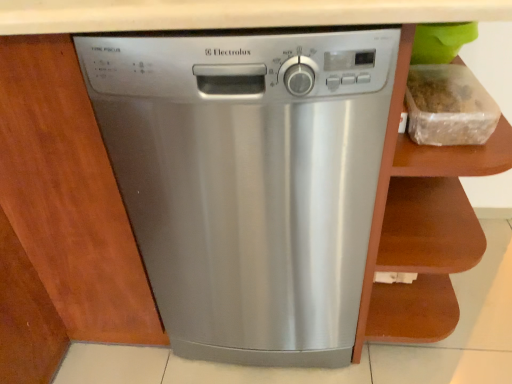
This screenshot has height=384, width=512. What do you see at coordinates (249, 180) in the screenshot?
I see `stainless steel dishwasher at center` at bounding box center [249, 180].

You are a GUI agent. You are given a task and a screenshot of the screen. Output one action in this format:
    pyautogui.click(x=<x>, y=<y>)
    Task: Click on the clear plastic container at upper right
    
    Given the screenshot: What is the action you would take?
    pyautogui.click(x=449, y=106)

Where is `brown wood cabinet at right`? This screenshot has height=384, width=512. brown wood cabinet at right is located at coordinates (422, 227).

Does stainless steel dishwasher at center turn towards brown wood cabinet at right?

No, stainless steel dishwasher at center is not turned towards brown wood cabinet at right.

From the picture: Is stainless steel dishwasher at center taller or shorter than brown wood cabinet at right?

In the image, stainless steel dishwasher at center appears to be taller than brown wood cabinet at right.

From the image's perspective, who appears lower, stainless steel dishwasher at center or brown wood cabinet at right?

From the image's view, stainless steel dishwasher at center is below.

Can you confirm if stainless steel dishwasher at center is smaller than brown wood cabinet at right?

No, stainless steel dishwasher at center is not smaller than brown wood cabinet at right.

Is brown wood cabinet at right not close to clear plastic container at upper right?

No, brown wood cabinet at right is not far from clear plastic container at upper right.

Which of these two, brown wood cabinet at right or clear plastic container at upper right, is bigger?

With larger size is brown wood cabinet at right.

Would you say brown wood cabinet at right contains clear plastic container at upper right?

Yes, clear plastic container at upper right is a part of brown wood cabinet at right.

Are clear plastic container at upper right and stainless steel dishwasher at center beside each other?

No, clear plastic container at upper right is not next to stainless steel dishwasher at center.

Based on their positions, is clear plastic container at upper right located to the left or right of stainless steel dishwasher at center?

Based on their positions, clear plastic container at upper right is located to the right of stainless steel dishwasher at center.

Between point (481, 134) and point (234, 305), which one is positioned behind?

The point (234, 305) is farther from the camera.

Based on the photo, who is shorter, clear plastic container at upper right or stainless steel dishwasher at center?

clear plastic container at upper right is shorter.

From the image's perspective, is stainless steel dishwasher at center located beneath clear plastic container at upper right?

Indeed, from the image's perspective, stainless steel dishwasher at center is shown beneath clear plastic container at upper right.

Is point (192, 136) positioned after point (484, 140)?

That is False.

From a real-world perspective, is stainless steel dishwasher at center on top of clear plastic container at upper right?

Actually, stainless steel dishwasher at center is physically below clear plastic container at upper right in the real world.

In terms of size, does clear plastic container at upper right appear bigger or smaller than brown wood cabinet at right?

clear plastic container at upper right is smaller than brown wood cabinet at right.

Is clear plastic container at upper right next to brown wood cabinet at right and touching it?

There is a gap between clear plastic container at upper right and brown wood cabinet at right.

From a real-world perspective, is clear plastic container at upper right above or below brown wood cabinet at right?

In terms of real-world spatial position, clear plastic container at upper right is above brown wood cabinet at right.

From a real-world perspective, which object stands above the other?

stainless steel dishwasher at center.

How different are the orientations of brown wood cabinet at right and stainless steel dishwasher at center in degrees?

They differ by 1.18 degrees in their facing directions.

Is point (452, 202) less distant than point (305, 264)?

That is False.

Can you confirm if brown wood cabinet at right is bigger than stainless steel dishwasher at center?

No.

This screenshot has width=512, height=384. What are the coordinates of `home appliance below the brown wood cabinet at right (from the image's perspective)` in the screenshot? It's located at (249, 180).

You are a GUI agent. You are given a task and a screenshot of the screen. Output one action in this format:
    pyautogui.click(x=<x>, y=<y>)
    Task: Click on the food above the brown wood cabinet at right (from a real-world perspective)
    
    Given the screenshot: What is the action you would take?
    pyautogui.click(x=449, y=106)

When comparing their distances from clear plastic container at upper right, does brown wood cabinet at right or stainless steel dishwasher at center seem closer?

brown wood cabinet at right is positioned closer to the anchor clear plastic container at upper right.

Considering their positions, is brown wood cabinet at right positioned further to stainless steel dishwasher at center than clear plastic container at upper right?

clear plastic container at upper right lies further to stainless steel dishwasher at center than the other object.

When comparing their distances from stainless steel dishwasher at center, does clear plastic container at upper right or brown wood cabinet at right seem closer?

brown wood cabinet at right.

When comparing their distances from brown wood cabinet at right, does clear plastic container at upper right or stainless steel dishwasher at center seem closer?

The object closer to brown wood cabinet at right is stainless steel dishwasher at center.

Which object lies nearer to the anchor point clear plastic container at upper right, stainless steel dishwasher at center or brown wood cabinet at right?

brown wood cabinet at right.

Estimate the real-world distances between objects in this image. Which object is closer to brown wood cabinet at right, stainless steel dishwasher at center or clear plastic container at upper right?

stainless steel dishwasher at center is positioned closer to the anchor brown wood cabinet at right.

Locate an element on the screen. food between stainless steel dishwasher at center and brown wood cabinet at right is located at coordinates (449, 106).